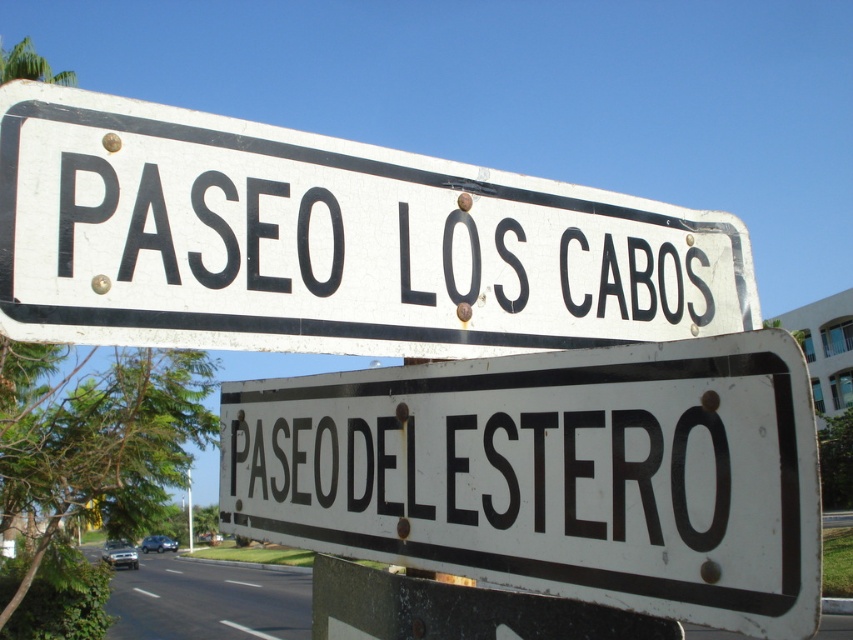
Between white matte street sign at upper center and white plastic pole at upper center, which one has more height?

white plastic pole at upper center is taller.

What do you see at coordinates (329, 243) in the screenshot? This screenshot has width=853, height=640. I see `white matte street sign at upper center` at bounding box center [329, 243].

Which is in front, point (393, 308) or point (189, 516)?

Point (393, 308) is more forward.

Find the location of `white matte street sign at upper center`. white matte street sign at upper center is located at coordinates (329, 243).

Between white matte sign at center and white plastic pole at upper center, which one appears on the left side from the viewer's perspective?

white plastic pole at upper center

Which of these two, white matte sign at center or white plastic pole at upper center, stands taller?

white plastic pole at upper center

You are a GUI agent. You are given a task and a screenshot of the screen. Output one action in this format:
    pyautogui.click(x=<x>, y=<y>)
    Task: Click on the white matte sign at center
    The image size is (853, 640).
    Given the screenshot: What is the action you would take?
    pyautogui.click(x=553, y=474)

Is white matte sign at center positioned at the back of white matte/black lettering at center?

No, it is not.

Is white matte sign at center wider than white matte/black lettering at center?

Yes, white matte sign at center is wider than white matte/black lettering at center.

The image size is (853, 640). I want to click on white matte sign at center, so click(553, 474).

The height and width of the screenshot is (640, 853). I want to click on white matte sign at center, so click(x=553, y=474).